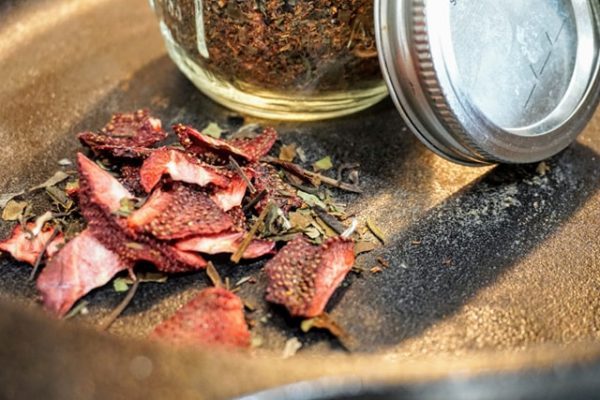
This screenshot has width=600, height=400. I want to click on glass jar, so click(218, 91).